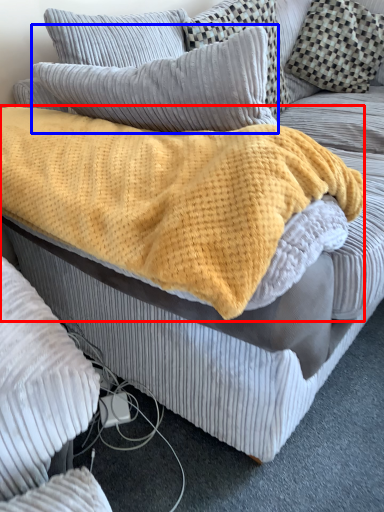
Question: Which object is further to the camera taking this photo, blanket (highlighted by a red box) or pillow (highlighted by a blue box)?

Choices:
 (A) blanket
 (B) pillow

Answer: (B)